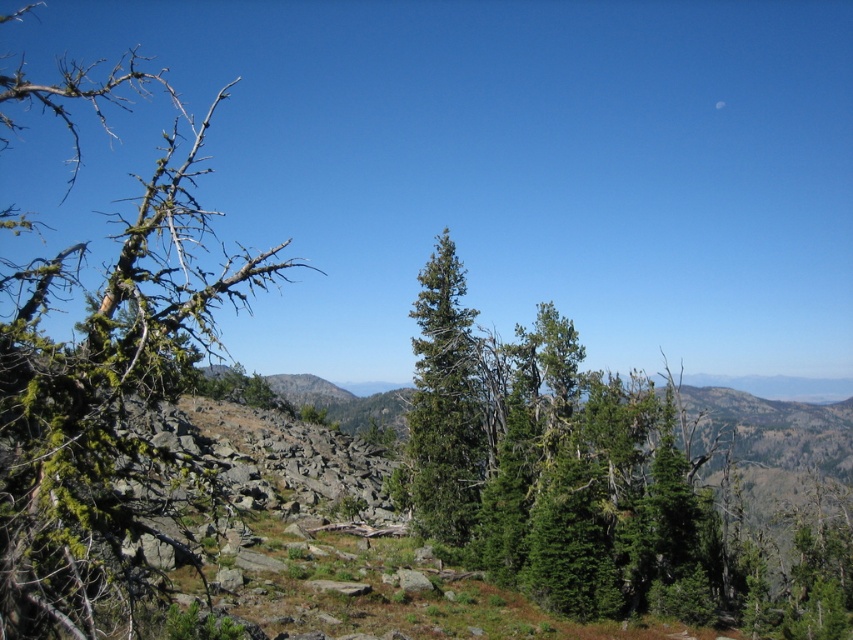
You are a hiker trying to navigate through the mountainous area. You notice the green matte evergreen tree at center and the green mossy branch at left. Which of these two objects is smaller in size?

The green matte evergreen tree at center is smaller in size compared to the green mossy branch at left.

You are a hiker who wants to take a photo of the green mossy branch at left from a specific spot. To ensure the branch is centered in your photo, where should you position yourself relative to the branch?

The green mossy branch at left is located at coordinates point (103, 385), so you should position yourself directly in front of it to center it in your photo.

You are a hiker who wants to take a photo of the green matte evergreen tree at center and the green matte tree at center. Which tree should you move closer to in order to capture both in a single frame?

You should move closer to the green matte evergreen tree at center because its width surpasses the green matte tree at center, allowing both to fit within the frame when positioned appropriately.